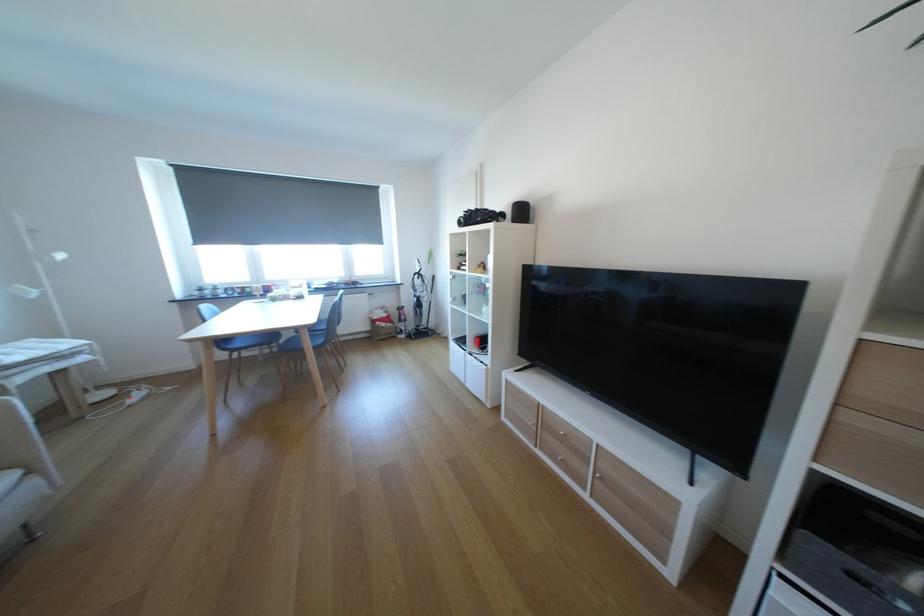
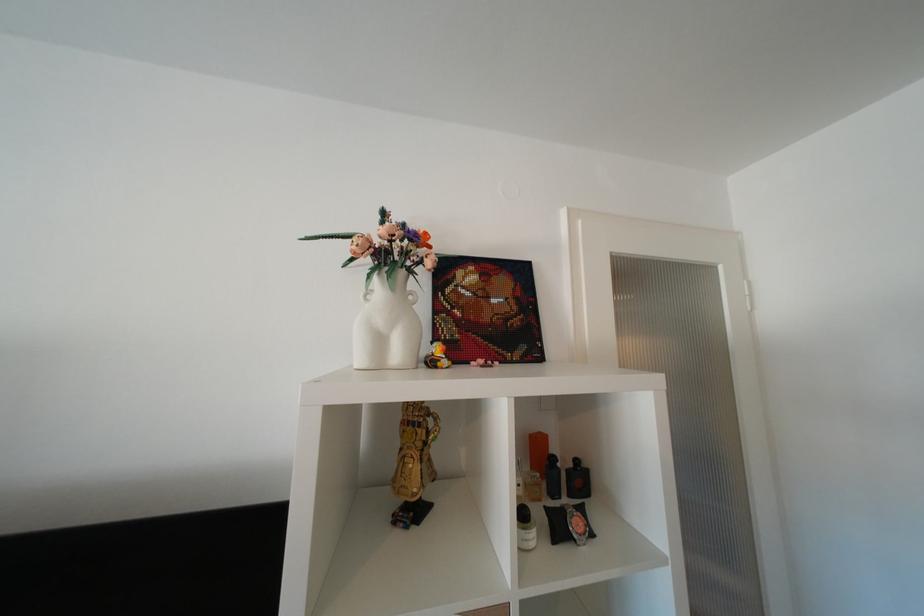
Question: How did the camera likely rotate?

Choices:
 (A) Left
 (B) Right
 (C) Up
 (D) Down

Answer: (B)